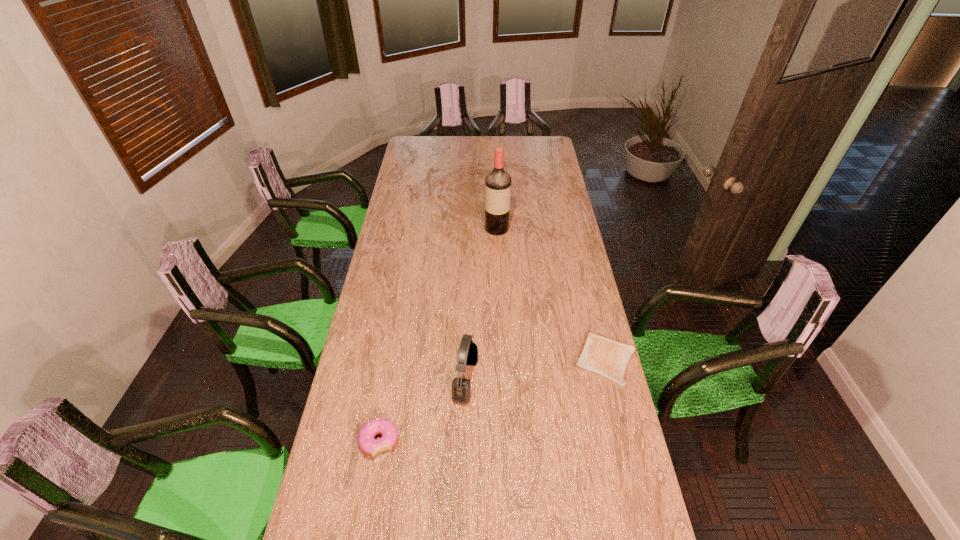
In order to click on the nearest object in this screenshot , I will do `click(367, 443)`.

Find the location of a particular element. The height and width of the screenshot is (540, 960). the second shortest object is located at coordinates click(367, 443).

Find the location of a particular element. The height and width of the screenshot is (540, 960). the shortest object is located at coordinates (600, 356).

Find the location of a particular element. This screenshot has width=960, height=540. toast is located at coordinates [x=600, y=356].

Where is `the farthest object`? the farthest object is located at coordinates (497, 182).

Where is `the tallest object`? the tallest object is located at coordinates (497, 182).

You are a GUI agent. You are given a task and a screenshot of the screen. Output one action in this format:
    pyautogui.click(x=<x>, y=<y>)
    Task: Click on the headset
    This screenshot has height=540, width=960.
    Given the screenshot: What is the action you would take?
    [468, 351]

At what (x,y) coordinates should I click in order to perform the action: click on the third shortest object. Please return your answer as a coordinate pair (x, y). This screenshot has width=960, height=540. Looking at the image, I should click on (468, 351).

You are a GUI agent. You are given a task and a screenshot of the screen. Output one action in this format:
    pyautogui.click(x=<x>, y=<y>)
    Task: Click on the free region located on the right of the nearest object
    
    Given the screenshot: What is the action you would take?
    pyautogui.click(x=431, y=441)

This screenshot has width=960, height=540. I want to click on vacant space located on the back of the toast, so click(x=583, y=269).